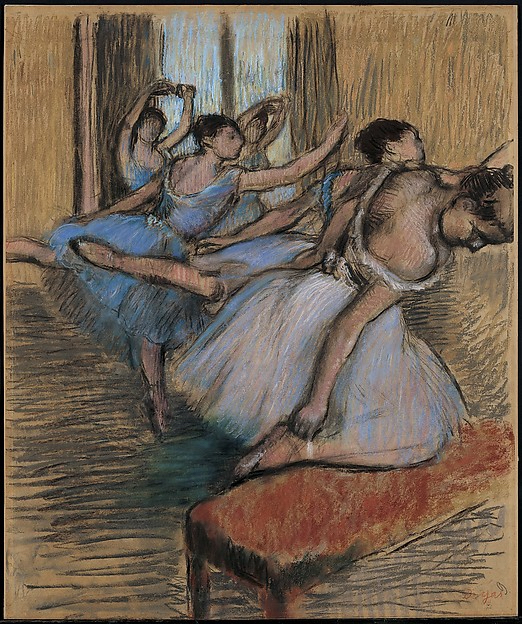
This screenshot has height=624, width=522. Find the location of `windows`. windows is located at coordinates (200, 67), (261, 67).